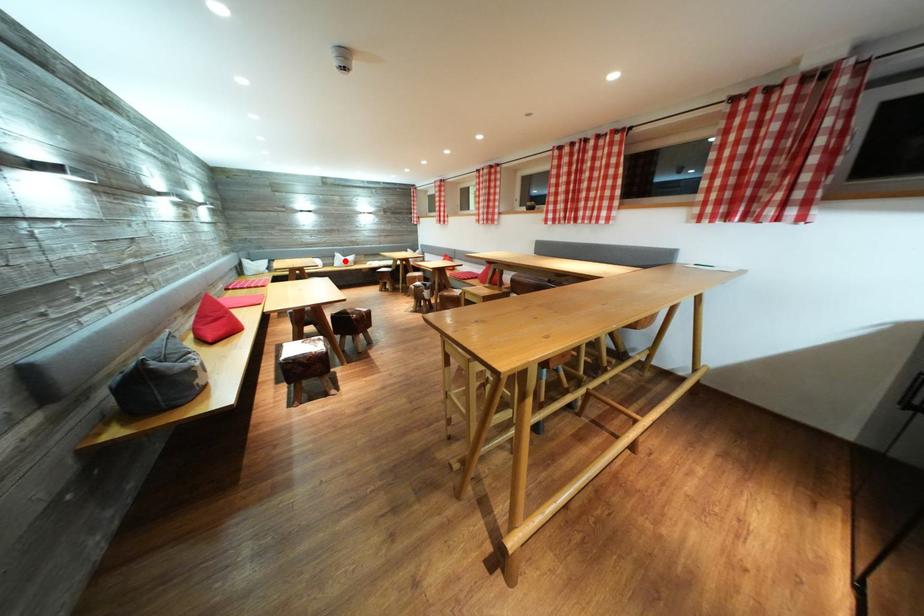
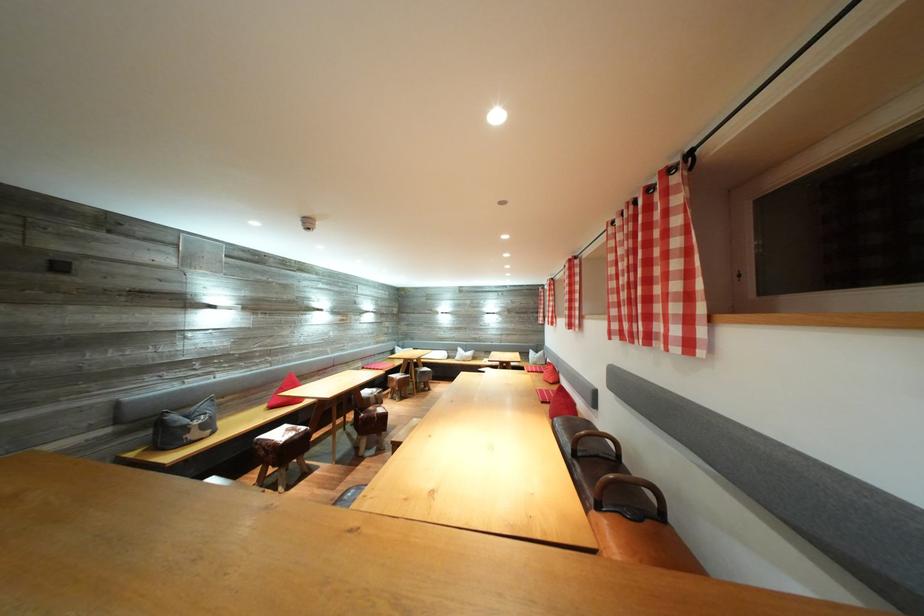
Question: I am providing you with two images of the same scene from different viewpoints. In image1, a red point is highlighted. Considering the same 3D point in image2, which of the following is correct?

Choices:
 (A) It is closer
 (B) It is farther

Answer: (B)